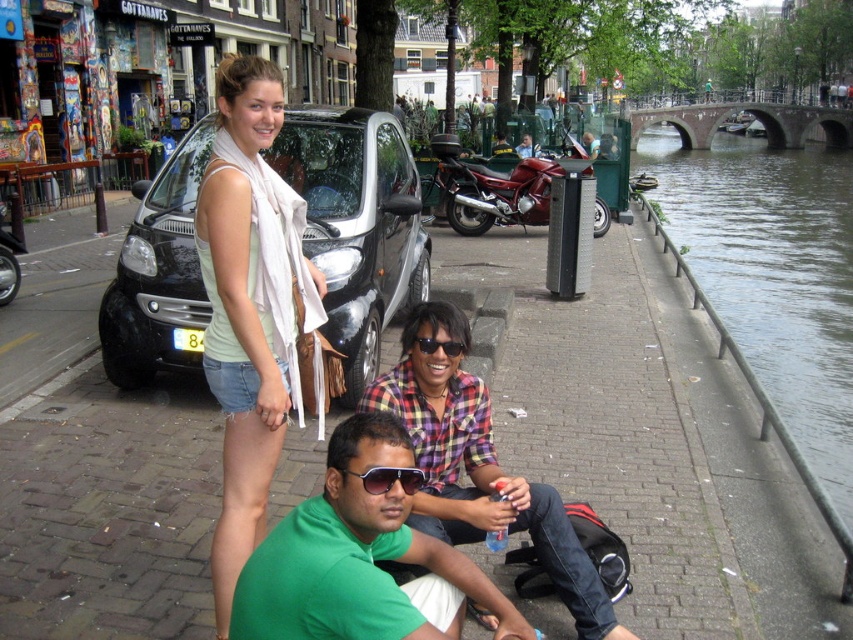
Question: Is black metallic car at center positioned before light green fabric scarf at upper center?

Choices:
 (A) yes
 (B) no

Answer: (B)

Question: Considering the real-world distances, which object is closest to the green matte shirt at lower center?

Choices:
 (A) greenish water at right
 (B) plaid shirt at center

Answer: (B)

Question: Does greenish water at right lie in front of plaid shirt at center?

Choices:
 (A) no
 (B) yes

Answer: (A)

Question: Based on their relative distances, which object is farther from the sunglasses at center?

Choices:
 (A) black metallic car at center
 (B) plaid shirt at center
 (C) greenish water at right
 (D) green matte shirt at lower center

Answer: (C)

Question: Which point is farther to the camera?

Choices:
 (A) (572, 572)
 (B) (450, 353)

Answer: (B)

Question: Where is plaid shirt at center located in relation to sunglasses at center in the image?

Choices:
 (A) below
 (B) above

Answer: (A)